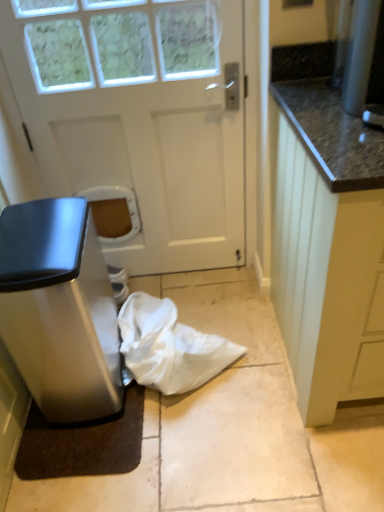
Question: Considering the relative sizes of satin silver trash can at left and white wood cabinet at right in the image provided, is satin silver trash can at left bigger than white wood cabinet at right?

Choices:
 (A) yes
 (B) no

Answer: (B)

Question: Is satin silver trash can at left wider than white wood cabinet at right?

Choices:
 (A) yes
 (B) no

Answer: (B)

Question: Are satin silver trash can at left and white wood cabinet at right located far from each other?

Choices:
 (A) yes
 (B) no

Answer: (B)

Question: From the image's perspective, is satin silver trash can at left located beneath white wood cabinet at right?

Choices:
 (A) yes
 (B) no

Answer: (A)

Question: From a real-world perspective, is satin silver trash can at left positioned over white wood cabinet at right based on gravity?

Choices:
 (A) yes
 (B) no

Answer: (B)

Question: Is white wood cabinet at right taller or shorter than white matte door at center?

Choices:
 (A) short
 (B) tall

Answer: (A)

Question: In terms of width, does white wood cabinet at right look wider or thinner when compared to white matte door at center?

Choices:
 (A) thin
 (B) wide

Answer: (B)

Question: From the image's perspective, is white wood cabinet at right located above or below white matte door at center?

Choices:
 (A) below
 (B) above

Answer: (A)

Question: From a real-world perspective, is white wood cabinet at right physically located above or below white matte door at center?

Choices:
 (A) below
 (B) above

Answer: (A)

Question: From a real-world perspective, relative to white fabric bag at lower center, is satin silver trash can at left vertically above or below?

Choices:
 (A) below
 (B) above

Answer: (B)

Question: Is satin silver trash can at left situated inside white fabric bag at lower center or outside?

Choices:
 (A) inside
 (B) outside

Answer: (B)

Question: In terms of size, does satin silver trash can at left appear bigger or smaller than white fabric bag at lower center?

Choices:
 (A) small
 (B) big

Answer: (B)

Question: From their relative heights in the image, would you say satin silver trash can at left is taller or shorter than white fabric bag at lower center?

Choices:
 (A) tall
 (B) short

Answer: (A)

Question: In terms of width, does white matte door at center look wider or thinner when compared to white wood cabinet at right?

Choices:
 (A) thin
 (B) wide

Answer: (A)

Question: Considering their positions, is white matte door at center located in front of or behind white wood cabinet at right?

Choices:
 (A) behind
 (B) front

Answer: (A)